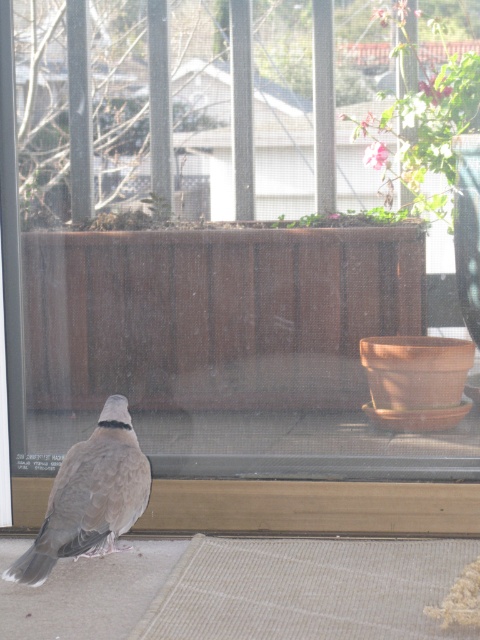
Question: Can you confirm if gray matte bird at lower left is positioned to the right of clear plastic screen door at left?

Choices:
 (A) yes
 (B) no

Answer: (A)

Question: Which object appears farthest from the camera in this image?

Choices:
 (A) gray matte bird at lower left
 (B) clear plastic screen door at left

Answer: (B)

Question: Does gray matte bird at lower left come in front of clear plastic screen door at left?

Choices:
 (A) yes
 (B) no

Answer: (A)

Question: Is gray matte bird at lower left below clear plastic screen door at left?

Choices:
 (A) yes
 (B) no

Answer: (A)

Question: Which point is closer to the camera?

Choices:
 (A) clear plastic screen door at left
 (B) gray matte bird at lower left

Answer: (B)

Question: Which of the following is the farthest from the observer?

Choices:
 (A) (86, 508)
 (B) (9, 38)

Answer: (B)